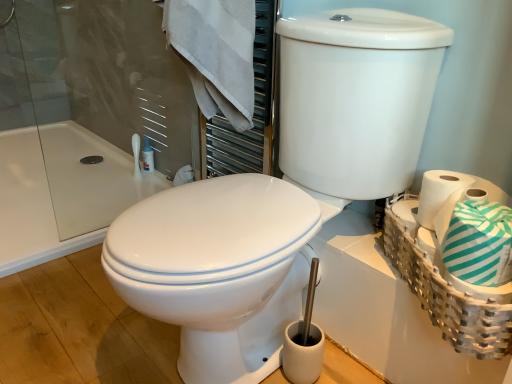
Question: Is white glossy toilet at center, positioned as the 2th toilet in right-to-left order, facing away from teal striped toilet paper at right?

Choices:
 (A) yes
 (B) no

Answer: (B)

Question: Is white glossy toilet at center, positioned as the 2th toilet in right-to-left order, behind teal striped toilet paper at right?

Choices:
 (A) no
 (B) yes

Answer: (A)

Question: Does white glossy toilet at center, which is the 1th toilet from left to right, appear on the left side of teal striped toilet paper at right?

Choices:
 (A) yes
 (B) no

Answer: (A)

Question: From the image's perspective, would you say white glossy toilet at center, which is the 1th toilet from left to right, is shown under teal striped toilet paper at right?

Choices:
 (A) yes
 (B) no

Answer: (A)

Question: Can teal striped toilet paper at right be found inside white glossy toilet at center, which is the 1th toilet from left to right?

Choices:
 (A) yes
 (B) no

Answer: (B)

Question: Does white glossy toilet at center, which is the 1th toilet from left to right, appear on the right side of teal striped toilet paper at right?

Choices:
 (A) yes
 (B) no

Answer: (B)

Question: From the image's perspective, does white woven basket at right appear higher than white cotton towel at upper left?

Choices:
 (A) no
 (B) yes

Answer: (A)

Question: Considering the relative sizes of white woven basket at right and white cotton towel at upper left in the image provided, is white woven basket at right shorter than white cotton towel at upper left?

Choices:
 (A) no
 (B) yes

Answer: (B)

Question: Is white cotton towel at upper left at the back of white woven basket at right?

Choices:
 (A) no
 (B) yes

Answer: (A)

Question: Is white woven basket at right far from white cotton towel at upper left?

Choices:
 (A) no
 (B) yes

Answer: (A)

Question: Does white woven basket at right contain white cotton towel at upper left?

Choices:
 (A) no
 (B) yes

Answer: (A)

Question: From the image's perspective, is white woven basket at right below white cotton towel at upper left?

Choices:
 (A) no
 (B) yes

Answer: (B)

Question: Is white glossy toilet at center, positioned as the 2th toilet in left-to-right order, to the left of white cotton towel at upper left from the viewer's perspective?

Choices:
 (A) no
 (B) yes

Answer: (A)